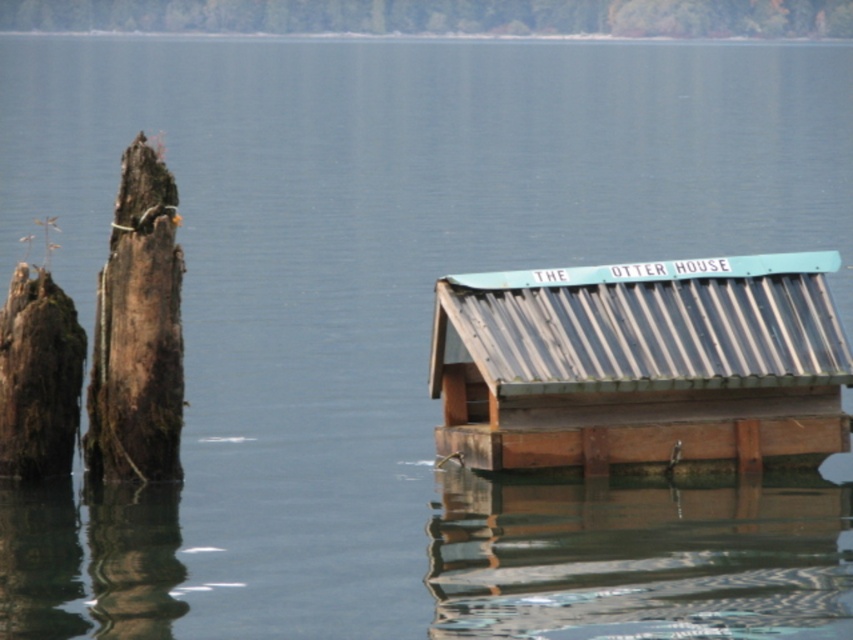
You are standing at the edge of the lake looking towards the wooden structure. You notice two points marked on the water surface. Which point is closer to you, the point at coordinate (96, 445) or the point at (70, 312)?

The point at coordinate (70, 312) is closer to you because the point at (96, 445) is behind it.

You are an architect designing a new floating structure. You want to ensure that the new design will be visually balanced with the existing elements in the scene. Considering the sizes of the metallic corrugated roof at center and the brown rough tree trunk at left, which object should you reference for scale when planning the dimensions of your new structure?

You should reference the metallic corrugated roof at center for scale since it is larger than the brown rough tree trunk at left, ensuring the new structure maintains visual balance with the existing elements.

Looking at this image, you are a contractor assessing the height of the metallic corrugated roof at center and the dark brown wood at left for a renovation project. Which object is taller?

The dark brown wood at left is taller than the metallic corrugated roof at center.